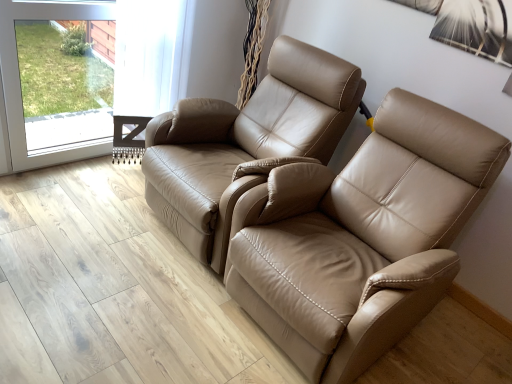
The height and width of the screenshot is (384, 512). I want to click on free space between tan leather chair at center, arranged as the second chair when viewed from the right, and tan leather recliner at center, which appears as the first chair when viewed from the right, so click(x=167, y=266).